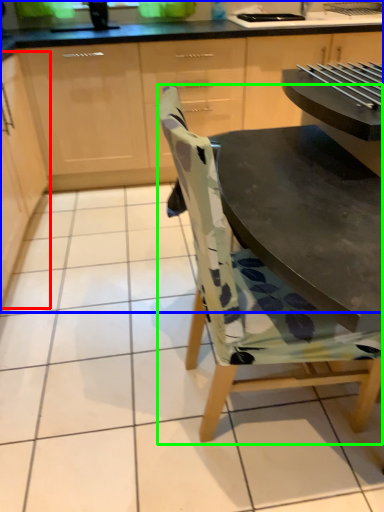
Question: Which object is positioned farthest from cabinetry (highlighted by a red box)? Select from cabinetry (highlighted by a blue box) and chair (highlighted by a green box).

Choices:
 (A) cabinetry
 (B) chair

Answer: (B)